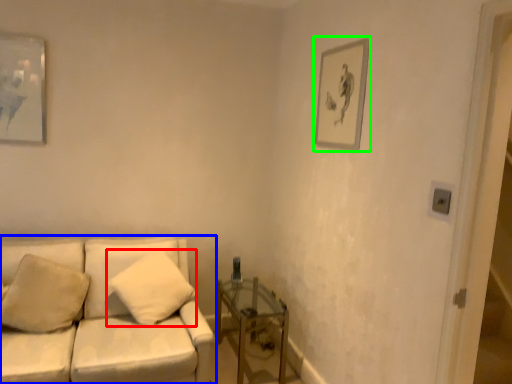
Question: Based on their relative distances, which object is farther from pillow (highlighted by a red box)? Choose from studio couch (highlighted by a blue box) and picture frame (highlighted by a green box).

Choices:
 (A) studio couch
 (B) picture frame

Answer: (B)